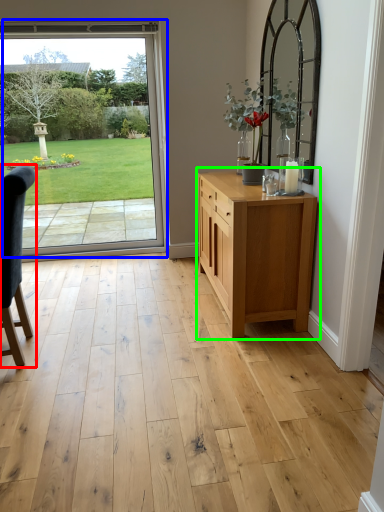
Question: Estimate the real-world distances between objects in this image. Which object is farther from chair (highlighted by a red box), door (highlighted by a blue box) or chest of drawers (highlighted by a green box)?

Choices:
 (A) door
 (B) chest of drawers

Answer: (A)